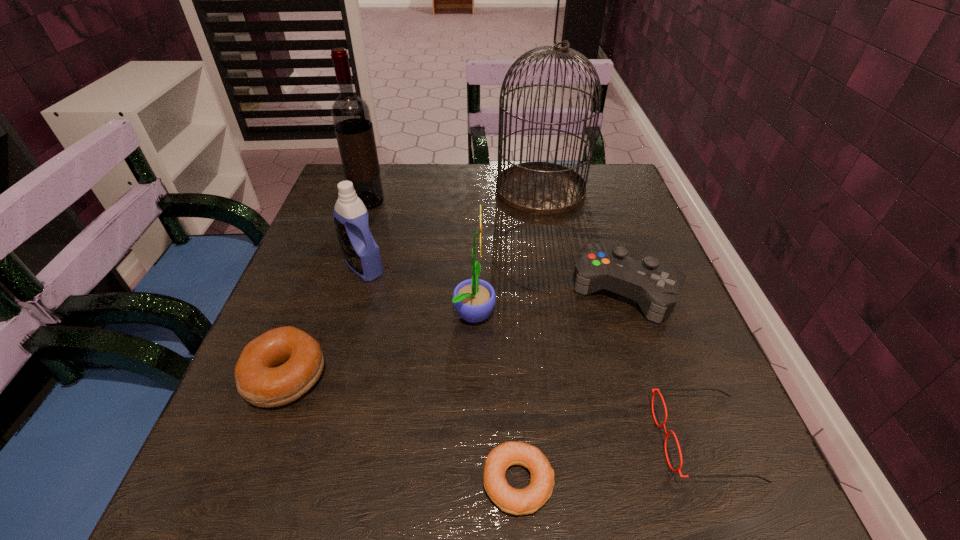
At what (x,y) coordinates should I click in order to perform the action: click on birdcage that is at the far edge. Please return your answer as a coordinate pair (x, y). This screenshot has width=960, height=540. Looking at the image, I should click on (542, 188).

The image size is (960, 540). Find the location of `wine bottle that is at the far edge`. wine bottle that is at the far edge is located at coordinates (351, 116).

Image resolution: width=960 pixels, height=540 pixels. What are the coordinates of `spectacles located at the near edge` in the screenshot? It's located at (656, 390).

Find the location of a particular element. The width and height of the screenshot is (960, 540). bagel located at the near edge is located at coordinates (528, 500).

Identify the location of wine bottle at the left edge. (351, 116).

The height and width of the screenshot is (540, 960). I want to click on detergent that is at the left edge, so click(362, 255).

Where is `bagel present at the left edge`? bagel present at the left edge is located at coordinates (276, 368).

Identify the location of birdcage at the right edge. The image size is (960, 540). (542, 188).

The height and width of the screenshot is (540, 960). I want to click on control that is positioned at the right edge, so click(656, 286).

I want to click on spectacles situated at the right edge, so click(656, 390).